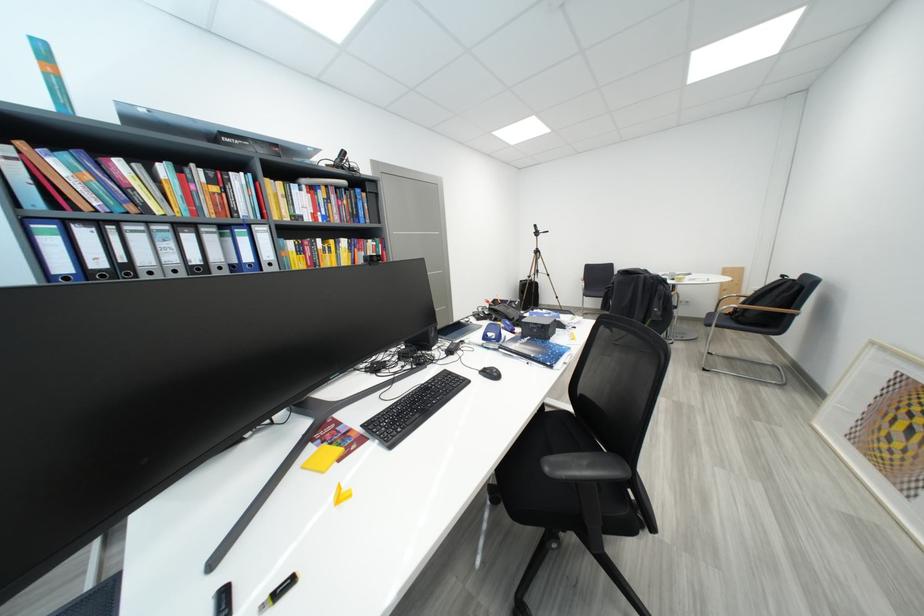
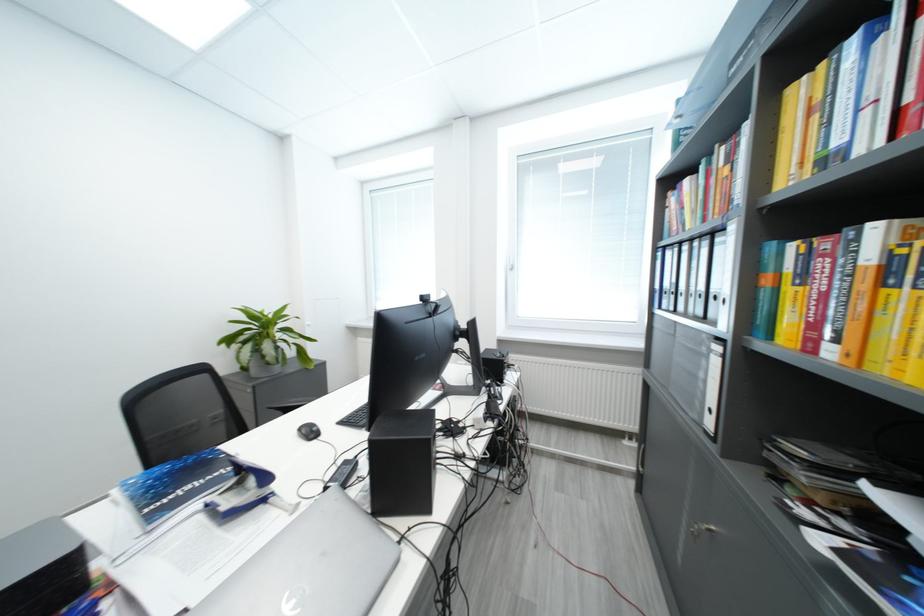
The point at (33, 223) is marked in the first image. Where is the corresponding point in the second image?

(664, 253)